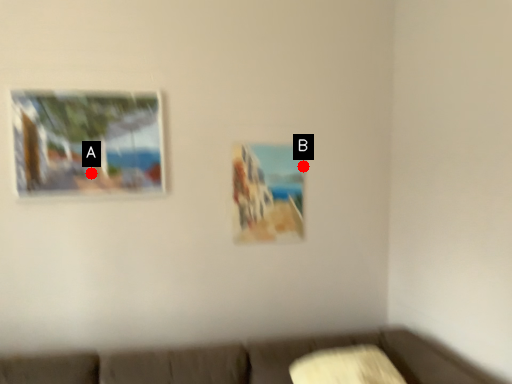
Question: Two points are circled on the image, labeled by A and B beside each circle. Which point is closer to the camera?

Choices:
 (A) A is closer
 (B) B is closer

Answer: (A)